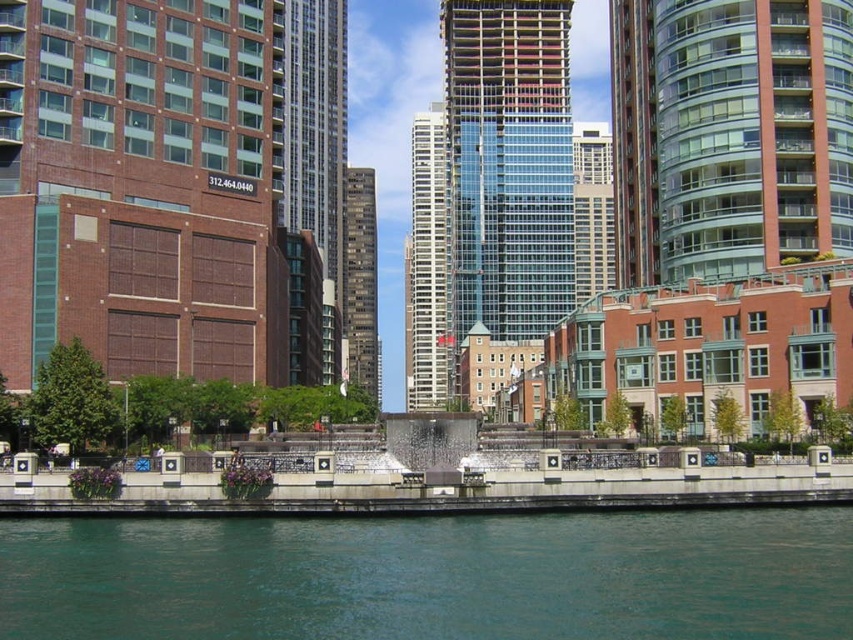
Is glassy reflective skyscraper at center above dark gray concrete building at center?

Yes, glassy reflective skyscraper at center is above dark gray concrete building at center.

Between point (457, 17) and point (370, 284), which one is positioned in front?

Positioned in front is point (457, 17).

The width and height of the screenshot is (853, 640). I want to click on glassy reflective skyscraper at center, so click(508, 164).

Where is `glassy reflective skyscraper at center`? The height and width of the screenshot is (640, 853). glassy reflective skyscraper at center is located at coordinates (508, 164).

Does glassy steel skyscraper at center appear on the right side of dark gray concrete building at center?

Incorrect, glassy steel skyscraper at center is not on the right side of dark gray concrete building at center.

The image size is (853, 640). Identify the location of glassy steel skyscraper at center. (316, 140).

Does green water at lower center have a smaller size compared to white glass building at center?

Indeed, green water at lower center has a smaller size compared to white glass building at center.

Between green water at lower center and white glass building at center, which one is positioned higher?

Positioned higher is white glass building at center.

Find the location of `green water at lower center`. green water at lower center is located at coordinates (432, 577).

Find the location of a particular element. The height and width of the screenshot is (640, 853). green water at lower center is located at coordinates tap(432, 577).